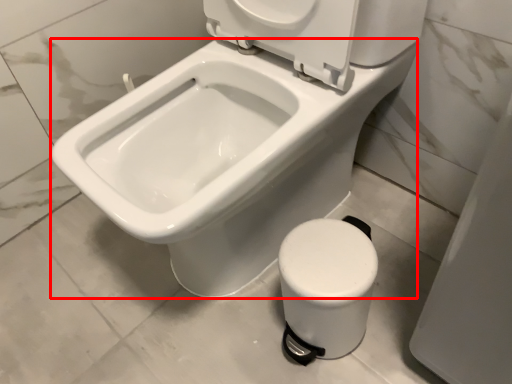
Question: From the image's perspective, where is bidet (annotated by the red box) located in relation to toilet in the image?

Choices:
 (A) below
 (B) above

Answer: (B)